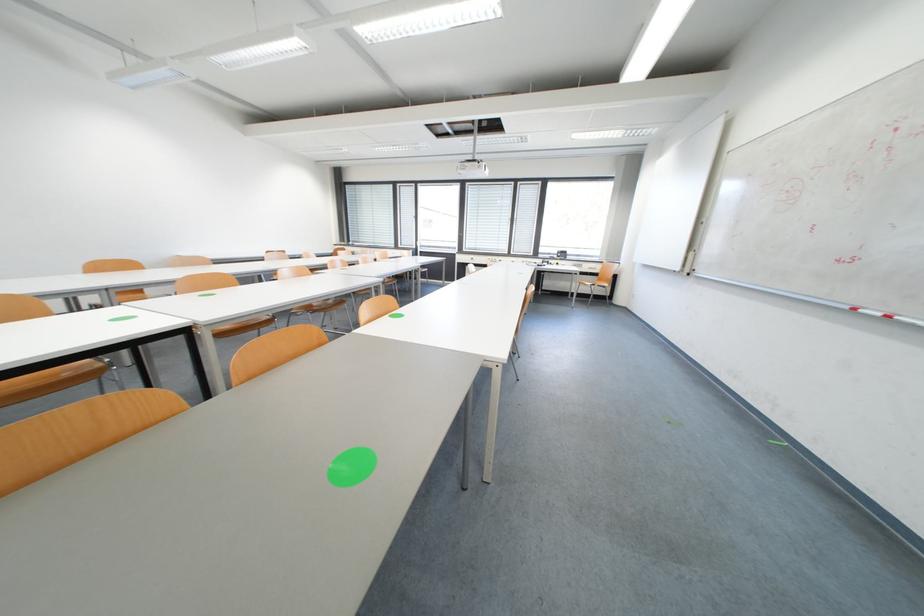
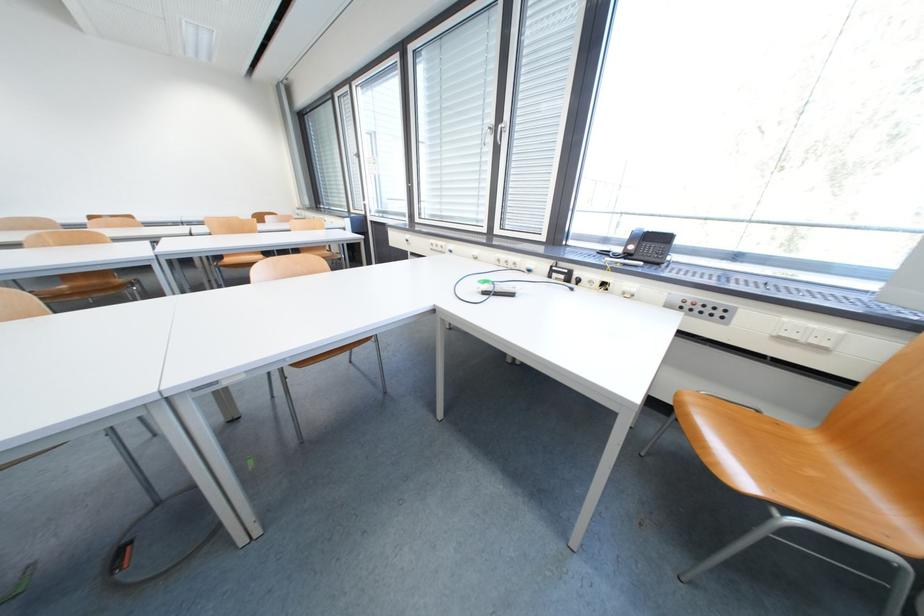
Where in the second image is the point corresponding to pixel 569 254 from the first image?

(670, 240)